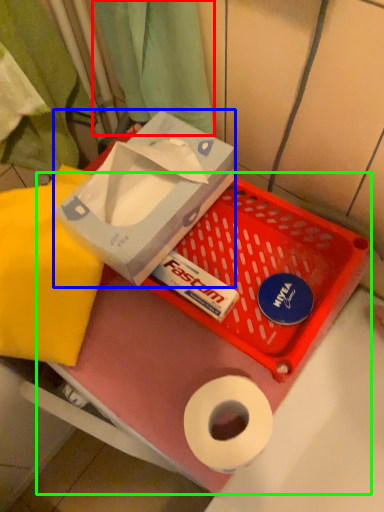
Question: Estimate the real-world distances between objects in this image. Which object is farther from curtain (highlighted by a red box), box (highlighted by a blue box) or box (highlighted by a green box)?

Choices:
 (A) box
 (B) box

Answer: (B)